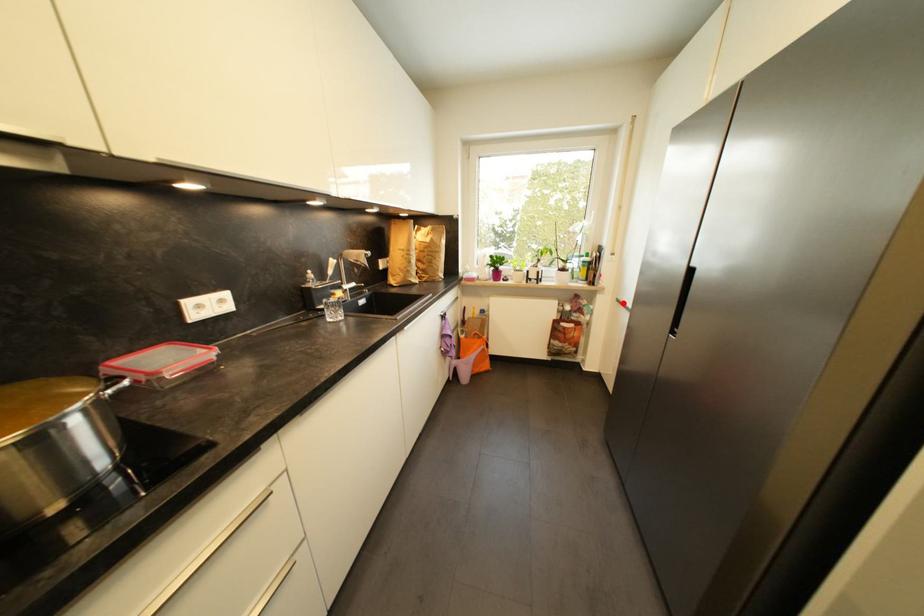
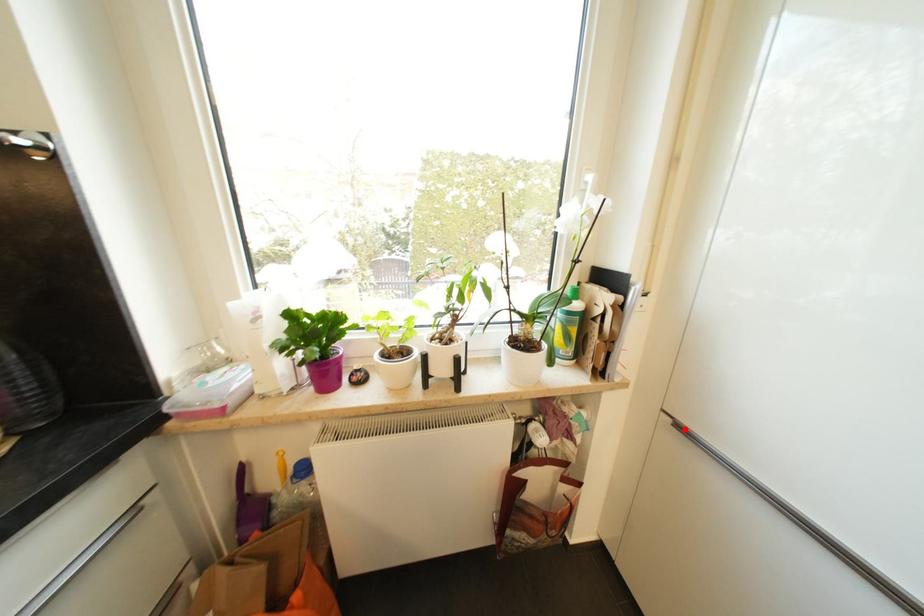
I am providing you with two images of the same scene from different viewpoints. A red point is marked on the first image and another point is marked on the second image. Is the red point in image1 aligned with the point shown in image2?

Yes